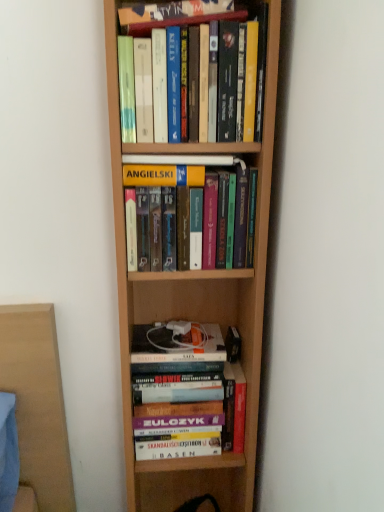
Locate an element on the screen. The height and width of the screenshot is (512, 384). vacant region under hardcover books at center, marked as the second book in a bottom-to-top arrangement (from a real-world perspective) is located at coordinates (182, 345).